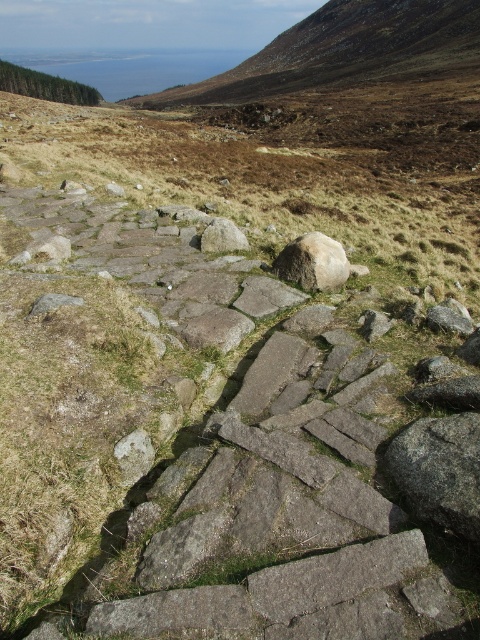
You are a hiker navigating the rugged terrain and come across the white smooth rock at center and the gray rough rock at center. Which rock would you choose to step on if you want to avoid slipping?

The white smooth rock at center is bigger than the gray rough rock at center, so stepping on the white smooth rock at center would provide a larger and more stable surface, reducing the risk of slipping.

You are a hiker who wants to place a small flag exactly between the white smooth rock at center and the gray rough rock at center. Which rock should you stand closer to while placing the flag?

You should stand closer to the gray rough rock at center because the white smooth rock at center is to the right of it, so the midpoint between them would require positioning closer to the gray rough rock at center.